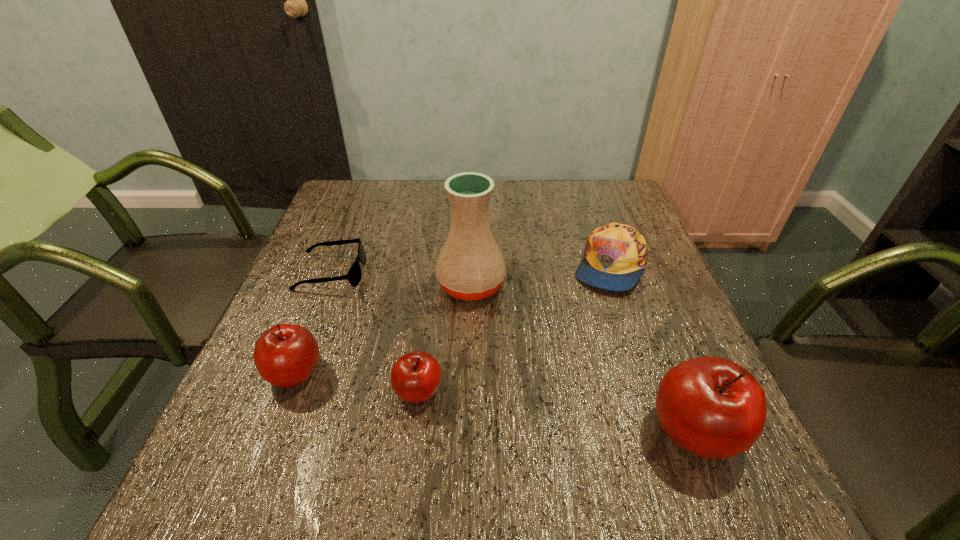
At what (x,y) coordinates should I click in order to perform the action: click on vacant region located 0.180m on the back of the rightmost apple. Please return your answer as a coordinate pair (x, y). Looking at the image, I should click on (652, 322).

Find the location of `free spot located 0.150m on the right of the tallest object`. free spot located 0.150m on the right of the tallest object is located at coordinates (569, 285).

The width and height of the screenshot is (960, 540). What are the coordinates of `vacant position located 0.140m on the front-facing side of the shortest object` in the screenshot? It's located at (421, 273).

Locate an element on the screen. The image size is (960, 540). free space located on the bill of the cap is located at coordinates (650, 384).

Where is `apple at the left edge`? The width and height of the screenshot is (960, 540). apple at the left edge is located at coordinates (285, 355).

Locate an element on the screen. The width and height of the screenshot is (960, 540). sunglasses located in the left edge section of the desktop is located at coordinates (354, 275).

Find the location of a particular element. apple located at the right edge is located at coordinates (712, 407).

This screenshot has width=960, height=540. I want to click on cap located in the right edge section of the desktop, so click(x=616, y=255).

The image size is (960, 540). In order to click on object positioned at the near right corner in this screenshot , I will do `click(712, 407)`.

At what (x,y) coordinates should I click in order to perform the action: click on vacant space at the far edge of the desktop. Please return your answer as a coordinate pair (x, y). This screenshot has height=540, width=960. Looking at the image, I should click on (564, 221).